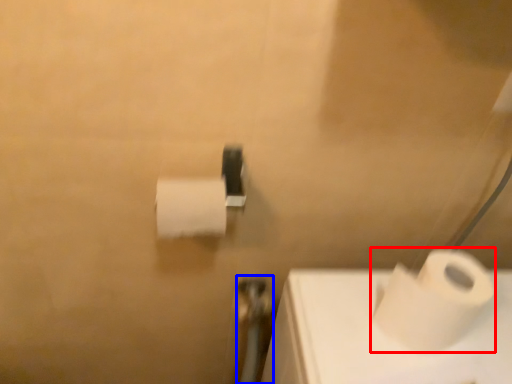
Question: Which object appears farthest to the camera in this image, toilet paper (highlighted by a red box) or shower (highlighted by a blue box)?

Choices:
 (A) toilet paper
 (B) shower

Answer: (B)